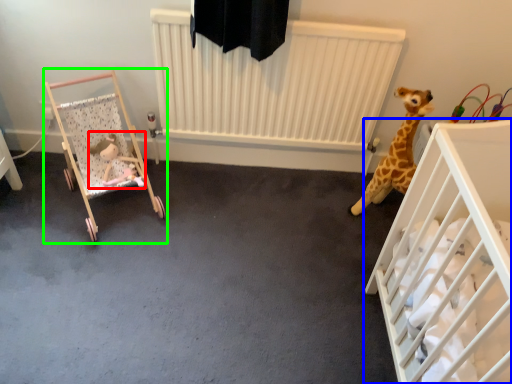
Question: Which object is positioned farthest from toy (highlighted by a red box)? Select from infant bed (highlighted by a blue box) and infant bed (highlighted by a green box).

Choices:
 (A) infant bed
 (B) infant bed

Answer: (A)